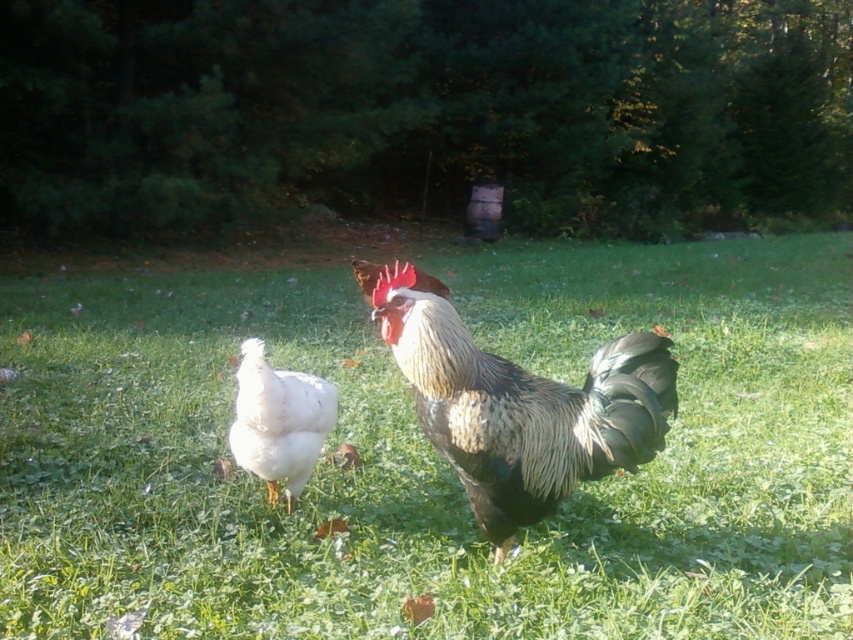
You are a photographer trying to capture the black and white feathered rooster at center. You have a camera with a zoom lens that can focus on a specific point. The coordinates provided are point [521,408]. Can you confirm if this point is where the rooster is located?

Yes, the point [521,408] corresponds to the black and white feathered rooster at center, so focusing there will capture the rooster.

You are a small bird flying over the green grassy at center and the white feathered chicken at center. When you land, which surface will you find shorter?

The green grassy at center is shorter than the white feathered chicken at center, so you will find the green grassy at center to be shorter.